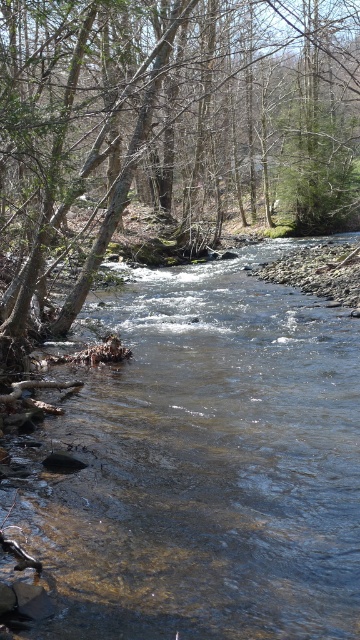
Where is `clear water stream at center`? This screenshot has height=640, width=360. clear water stream at center is located at coordinates (204, 467).

In the scene shown: Who is taller, clear water stream at center or brown bark tree at left?

brown bark tree at left

In order to click on clear water stream at center in this screenshot , I will do `click(204, 467)`.

Locate an element on the screen. clear water stream at center is located at coordinates (204, 467).